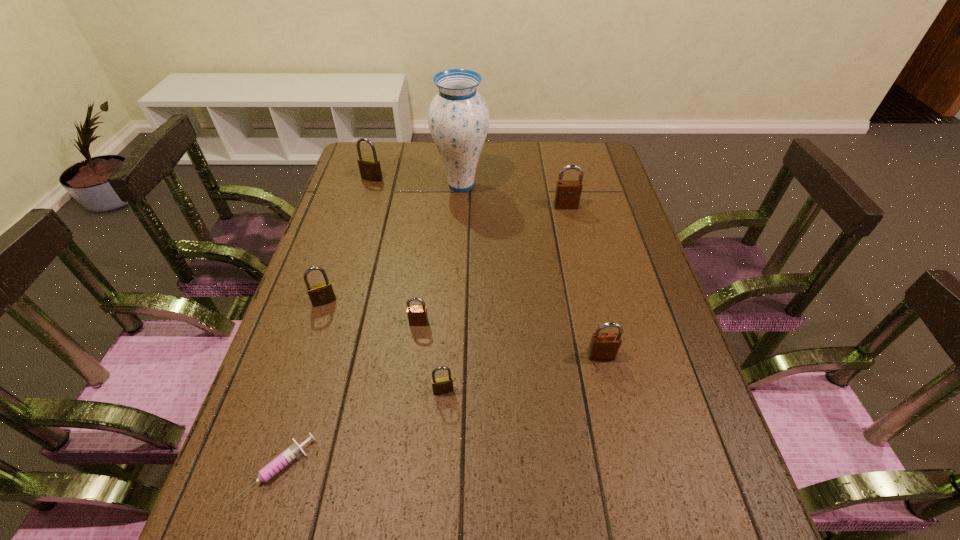
Where is `the tallest object`? the tallest object is located at coordinates (458, 117).

Locate an element on the screen. blue vase is located at coordinates (458, 117).

Find the location of a particular element. The width and height of the screenshot is (960, 540). the biggest brass padlock is located at coordinates (370, 169).

Find the location of `the farthest padlock`. the farthest padlock is located at coordinates (370, 169).

Identify the location of the biggest brown padlock. Image resolution: width=960 pixels, height=540 pixels. (568, 192).

Where is `the third farthest object`? The width and height of the screenshot is (960, 540). the third farthest object is located at coordinates (568, 192).

Where is `the fifth nearest object`? Image resolution: width=960 pixels, height=540 pixels. the fifth nearest object is located at coordinates (320, 294).

Locate an element on the screen. The height and width of the screenshot is (540, 960). the third farthest padlock is located at coordinates (320, 294).

At what (x,y) coordinates should I click in order to perform the action: click on the third nearest object. Please return your answer as a coordinate pair (x, y). Looking at the image, I should click on point(603,346).

I want to click on the second nearest padlock, so (x=603, y=346).